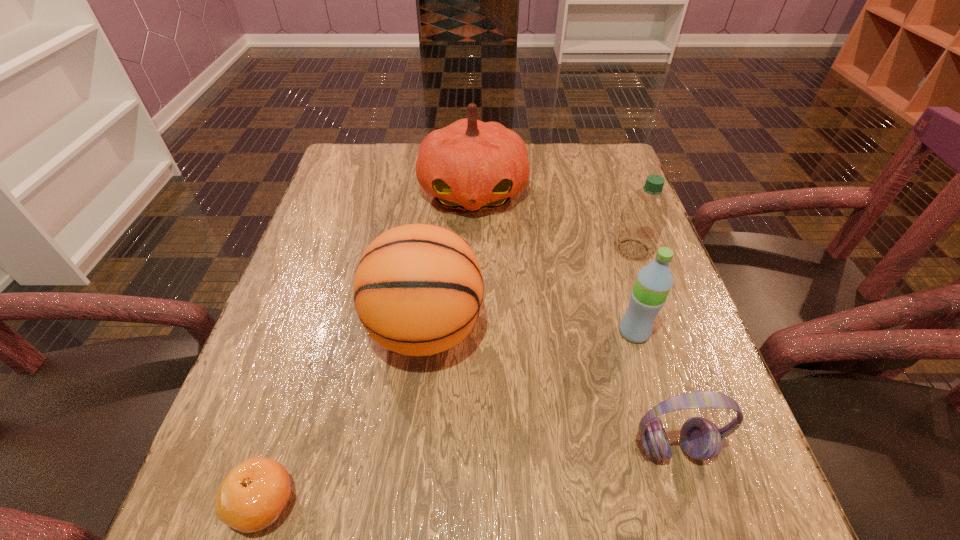
In order to click on pumpkin in this screenshot , I will do `click(471, 165)`.

Where is `basketball`? The width and height of the screenshot is (960, 540). basketball is located at coordinates (418, 290).

This screenshot has height=540, width=960. In order to click on the nearer water bottle in this screenshot , I will do `click(654, 281)`.

I want to click on the farther water bottle, so click(x=644, y=215).

You are a GUI agent. You are given a task and a screenshot of the screen. Output one action in this format:
    pyautogui.click(x=<x>, y=<y>)
    Task: Click on the headset
    Image resolution: width=960 pixels, height=540 pixels.
    Given the screenshot: What is the action you would take?
    pyautogui.click(x=700, y=438)

Where is `the second nearest object`? The image size is (960, 540). the second nearest object is located at coordinates (700, 438).

At what (x,y) coordinates should I click in order to perform the action: click on the nearest object. Please return your answer as a coordinate pair (x, y). Looking at the image, I should click on (253, 495).

The height and width of the screenshot is (540, 960). I want to click on the shortest object, so click(253, 495).

The height and width of the screenshot is (540, 960). I want to click on free space located 0.340m on the front-facing side of the farthest object, so click(x=470, y=339).

Locate an element on the screen. vacant area located on the back of the basketball is located at coordinates (439, 202).